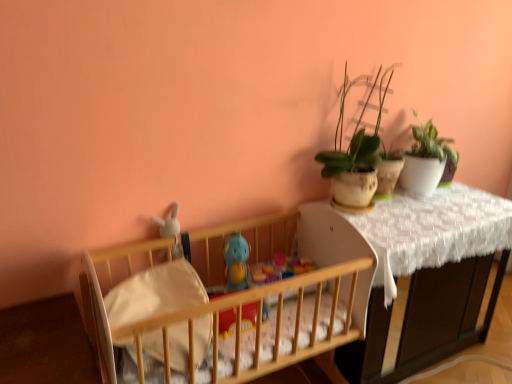
Question: Is point (415, 112) positioned closer to the camera than point (238, 266)?

Choices:
 (A) farther
 (B) closer

Answer: (A)

Question: Looking at the image, does green matte plant at upper right, marked as the first houseplant in a right-to-left arrangement, seem bigger or smaller compared to blue rubber duck at center, positioned as the second toy in left-to-right order?

Choices:
 (A) small
 (B) big

Answer: (B)

Question: Based on their relative distances, which object is farther from the white lace-covered table at upper right?

Choices:
 (A) blue rubber duck at center, positioned as the second toy in left-to-right order
 (B) matte clay pot at upper right, the first houseplant positioned from the left
 (C) white plush rabbit at left, the second toy positioned from the right
 (D) green matte plant at upper right, marked as the first houseplant in a right-to-left arrangement
 (E) wooden crib at left

Answer: (C)

Question: Which object is the farthest from the matte clay pot at upper right, the first houseplant positioned from the left?

Choices:
 (A) white fabric changing table at lower left
 (B) white plush rabbit at left, the second toy positioned from the right
 (C) blue rubber duck at center, which ranks as the first toy in right-to-left order
 (D) white lace-covered table at upper right
 (E) white soft crib sheet at center

Answer: (A)